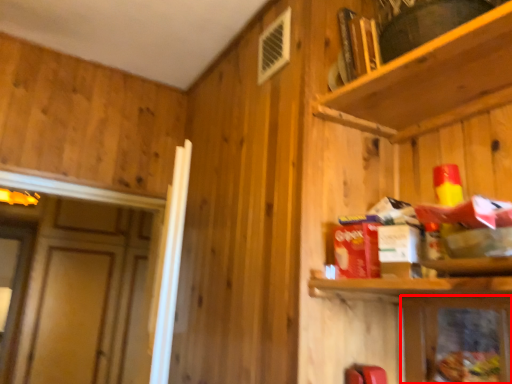
Question: Considering the relative positions of cabinetry (annotated by the red box) and shelf in the image provided, where is cabinetry (annotated by the red box) located with respect to the staircase?

Choices:
 (A) right
 (B) left

Answer: (A)